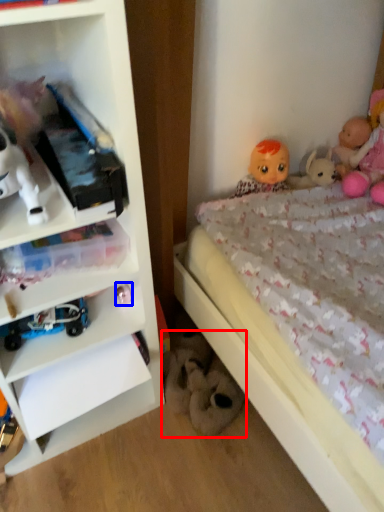
Question: Among these objects, which one is farthest to the camera, toy (highlighted by a red box) or toy (highlighted by a blue box)?

Choices:
 (A) toy
 (B) toy

Answer: (A)